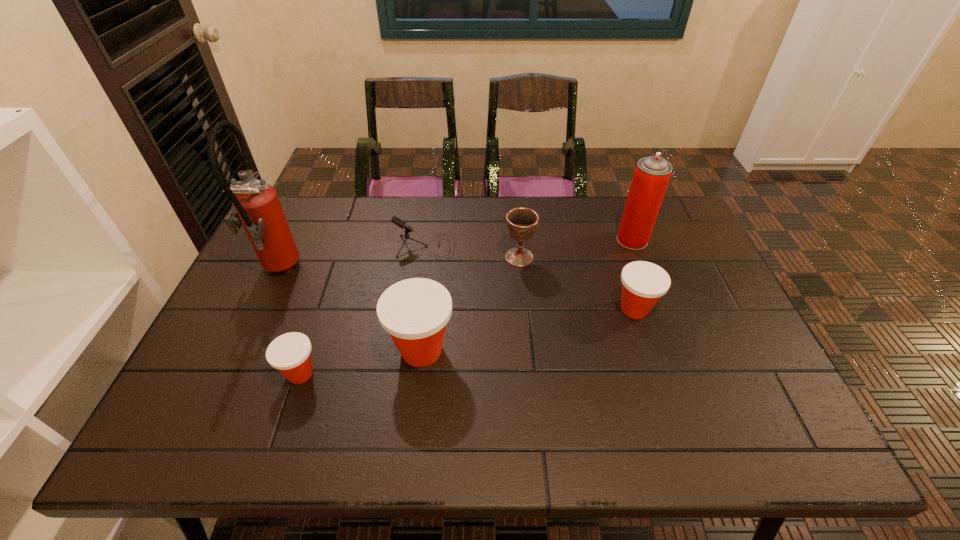
I want to click on vacant space that's between the third object from right to left and the rightmost Dixie cup, so coord(577,283).

This screenshot has width=960, height=540. I want to click on free spot between the chalice and the second tallest Dixie cup, so click(x=577, y=283).

Locate an element on the screen. The width and height of the screenshot is (960, 540). empty space that is in between the chalice and the aerosol can is located at coordinates (576, 248).

At what (x,y) coordinates should I click in order to perform the action: click on object that is the second closest to the leftmost Dixie cup. Please return your answer as a coordinate pair (x, y). Looking at the image, I should click on (256, 206).

What are the coordinates of `object that is the fourth nearest to the microphone` in the screenshot? It's located at (290, 353).

Point out which Dixie cup is positioned as the nearest to the second shortest Dixie cup. Please provide its 2D coordinates. Your answer should be formatted as a tuple, i.e. [(x, y)], where the tuple contains the x and y coordinates of a point satisfying the conditions above.

[(415, 311)]

This screenshot has height=540, width=960. Identify the location of Dixie cup object that ranks as the third closest to the microphone. 643,283.

The height and width of the screenshot is (540, 960). Identify the location of vacant space that satisfies the following two spatial constraints: 1. on the back side of the leftmost Dixie cup; 2. at the nozzle of the leftmost object. (334, 272).

Identify the location of free spot that satisfies the following two spatial constraints: 1. at the nozzle of the tallest object; 2. on the back side of the tallest Dixie cup. This screenshot has width=960, height=540. (240, 350).

This screenshot has height=540, width=960. What are the coordinates of `vacant space that satisfies the following two spatial constraints: 1. at the nozzle of the second tallest Dixie cup; 2. on the right side of the fire extinguisher` in the screenshot? It's located at (259, 309).